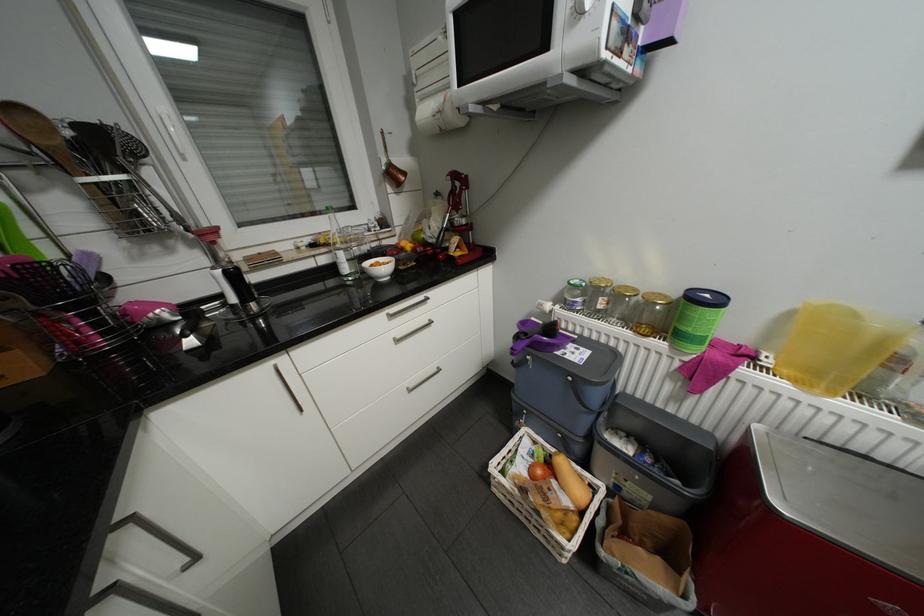
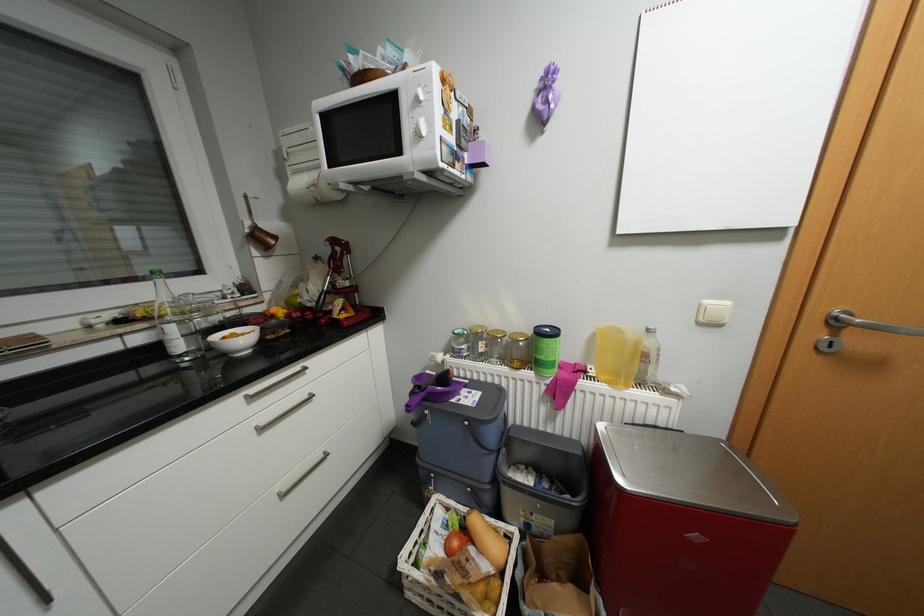
Find the pixel in the second image that matches [565,477] in the first image.

(481, 543)